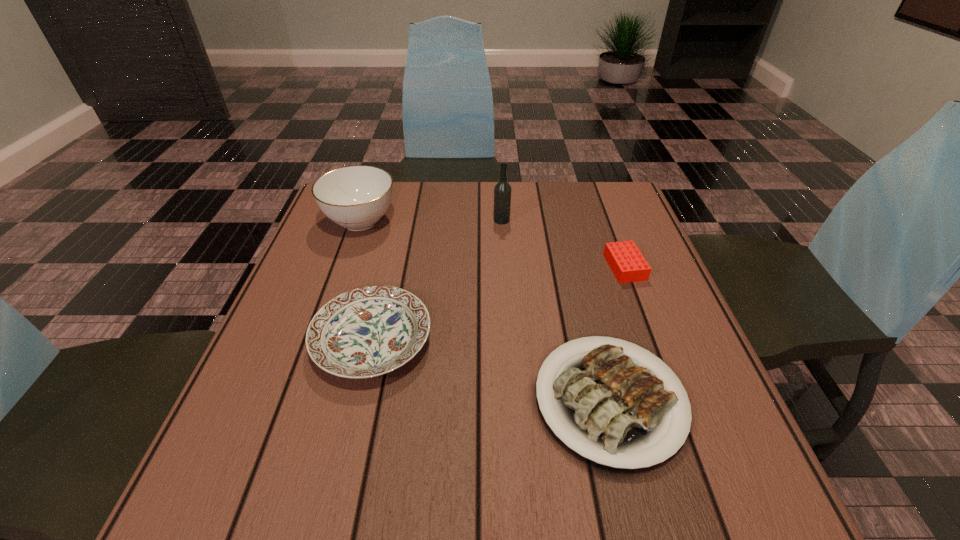
In order to click on vodka located at the far edge in this screenshot , I will do `click(502, 192)`.

The height and width of the screenshot is (540, 960). I want to click on chinaware that is positioned at the far edge, so click(356, 197).

You are a GUI agent. You are given a task and a screenshot of the screen. Output one action in this format:
    pyautogui.click(x=<x>, y=<y>)
    Task: Click on the object that is at the near edge
    
    Given the screenshot: What is the action you would take?
    pyautogui.click(x=620, y=413)

The height and width of the screenshot is (540, 960). Find the location of `chinaware that is at the left edge`. chinaware that is at the left edge is located at coordinates (356, 197).

Image resolution: width=960 pixels, height=540 pixels. I want to click on plate located in the left edge section of the desktop, so click(x=369, y=331).

You are a GUI agent. You are given a task and a screenshot of the screen. Output one action in this format:
    pyautogui.click(x=<x>, y=<y>)
    Task: Click on the Lego that is at the right edge
    This screenshot has height=540, width=960.
    Given the screenshot: What is the action you would take?
    pyautogui.click(x=627, y=263)

Find the location of `plate that is positioned at the right edge`. plate that is positioned at the right edge is located at coordinates (620, 413).

The width and height of the screenshot is (960, 540). In order to click on object located at the far left corner in this screenshot , I will do `click(356, 197)`.

You are a GUI agent. You are given a task and a screenshot of the screen. Output one action in this format:
    pyautogui.click(x=<x>, y=<y>)
    Task: Click on the object situated at the near right corner
    
    Given the screenshot: What is the action you would take?
    pyautogui.click(x=620, y=413)

In the image, there is a desktop. What are the coordinates of `free space at the far edge` in the screenshot? It's located at coord(484,213).